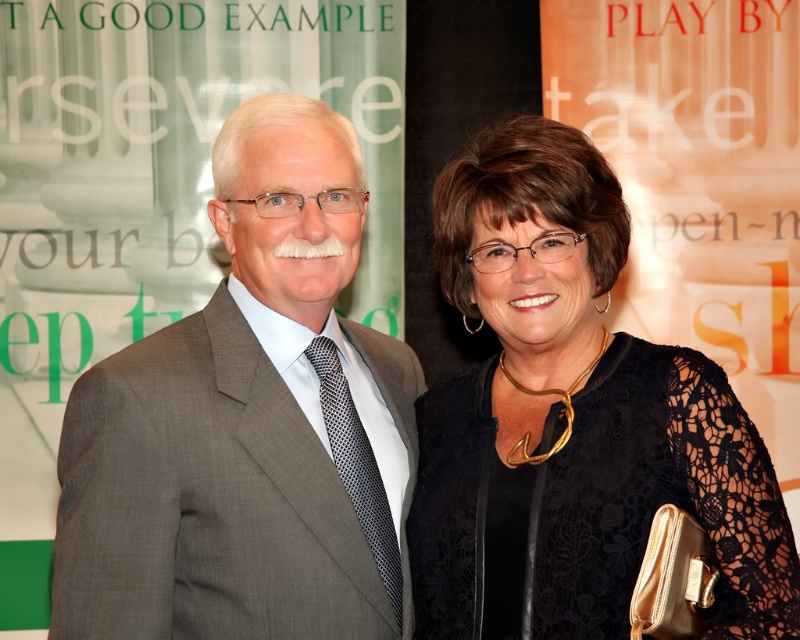
Is gray suit at center above black lace dress at center?

Correct, gray suit at center is located above black lace dress at center.

This screenshot has height=640, width=800. Identify the location of gray suit at center. (248, 424).

Is point (368, 416) closer to viewer compared to point (474, 579)?

No.

The height and width of the screenshot is (640, 800). Find the location of `gray suit at center`. gray suit at center is located at coordinates [x=248, y=424].